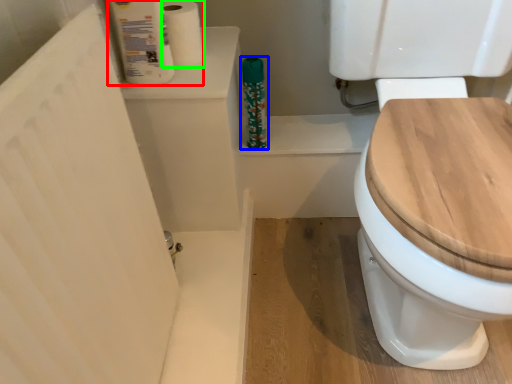
Question: Which is farther away from toilet paper (highlighted by a red box)? cleaning product (highlighted by a blue box) or toilet paper (highlighted by a green box)?

Choices:
 (A) cleaning product
 (B) toilet paper

Answer: (A)